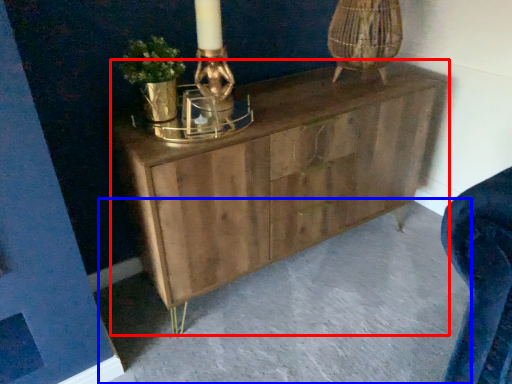
Question: Which object is closer to the camera taking this photo, chest of drawers (highlighted by a red box) or concrete (highlighted by a blue box)?

Choices:
 (A) chest of drawers
 (B) concrete

Answer: (B)